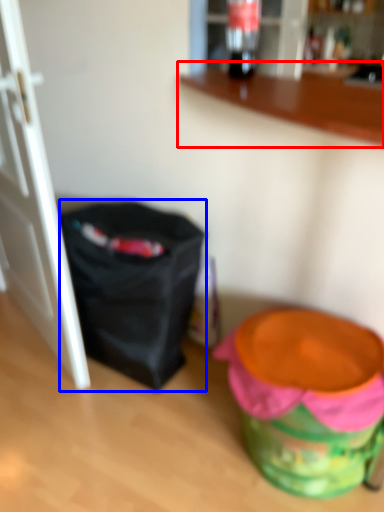
Question: Which object is further to the camera taking this photo, counter (highlighted by a red box) or bag (highlighted by a blue box)?

Choices:
 (A) counter
 (B) bag

Answer: (B)